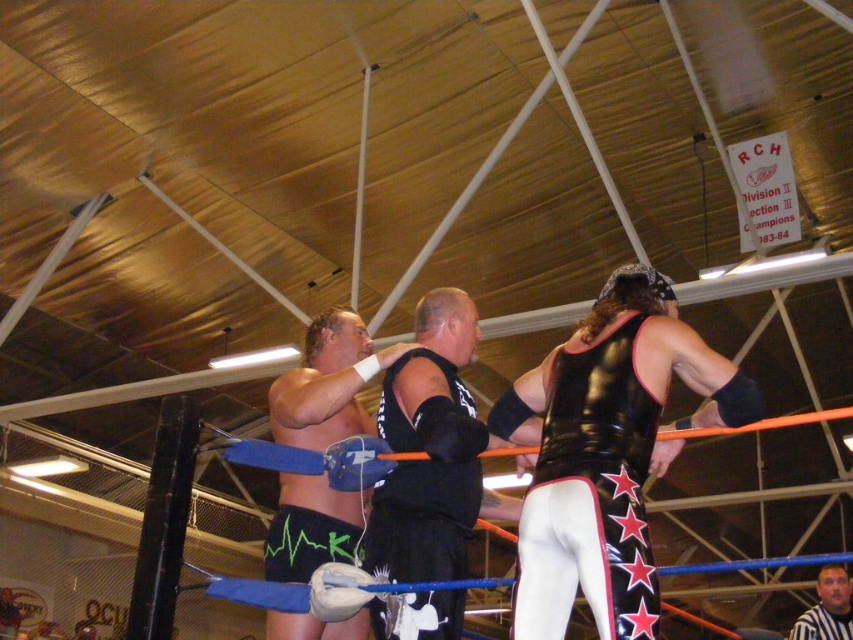
Between black leather vest at center and black matte vest at center, which one has more height?

black matte vest at center is taller.

Find the location of a particular element. black leather vest at center is located at coordinates (606, 454).

Who is lower down, black matte vest at center or smooth black shirt at center?

Positioned lower is smooth black shirt at center.

In the scene shown: Can you confirm if black matte vest at center is thinner than smooth black shirt at center?

Correct, black matte vest at center's width is less than smooth black shirt at center's.

Locate an element on the screen. The height and width of the screenshot is (640, 853). black matte vest at center is located at coordinates (432, 451).

Does black leather vest at center have a greater width compared to black matte shorts at center?

Indeed, black leather vest at center has a greater width compared to black matte shorts at center.

Between black leather vest at center and black matte shorts at center, which one appears on the right side from the viewer's perspective?

From the viewer's perspective, black leather vest at center appears more on the right side.

Locate an element on the screen. black leather vest at center is located at coordinates (606, 454).